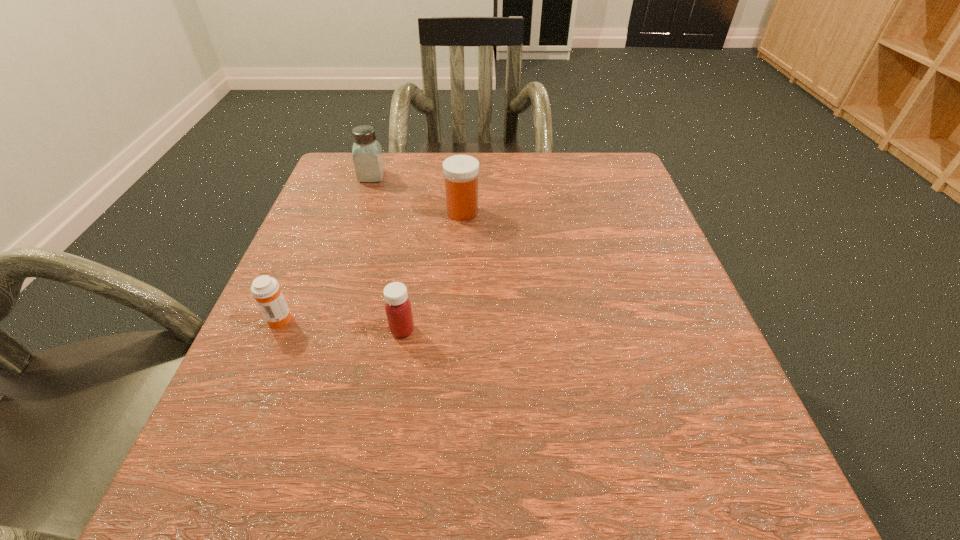
I want to click on vacant area at the near right corner, so click(648, 501).

Where is `free space between the leftmost object and the third nearest object`? Image resolution: width=960 pixels, height=540 pixels. free space between the leftmost object and the third nearest object is located at coordinates (371, 266).

Locate an element on the screen. The image size is (960, 540). empty location between the third nearest object and the leftmost object is located at coordinates (371, 266).

Locate an element on the screen. This screenshot has height=540, width=960. empty space between the farthest object and the second medicine from right to left is located at coordinates (387, 253).

I want to click on empty space between the second medicine from left to right and the rightmost medicine, so click(432, 271).

You are a GUI agent. You are given a task and a screenshot of the screen. Output one action in this format:
    pyautogui.click(x=<x>, y=<y>)
    Task: Click on the free space between the second medicine from left to right and the leftmost object
    The width and height of the screenshot is (960, 540).
    Given the screenshot: What is the action you would take?
    pyautogui.click(x=341, y=325)

Locate an element on the screen. This screenshot has width=960, height=540. free space between the third object from right to left and the second object from right to left is located at coordinates (387, 253).

The image size is (960, 540). I want to click on empty space that is in between the third object from left to right and the leftmost medicine, so click(x=341, y=325).

This screenshot has height=540, width=960. Identify the location of free point between the farthest object and the third object from left to right. (387, 253).

Image resolution: width=960 pixels, height=540 pixels. Find the location of `empty location between the second object from right to left and the second object from left to right`. empty location between the second object from right to left and the second object from left to right is located at coordinates (387, 253).